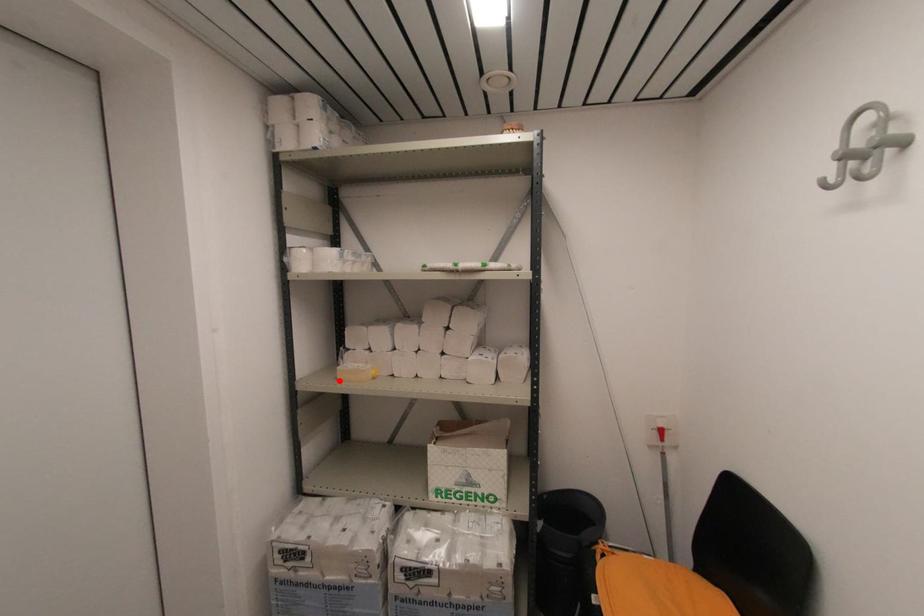
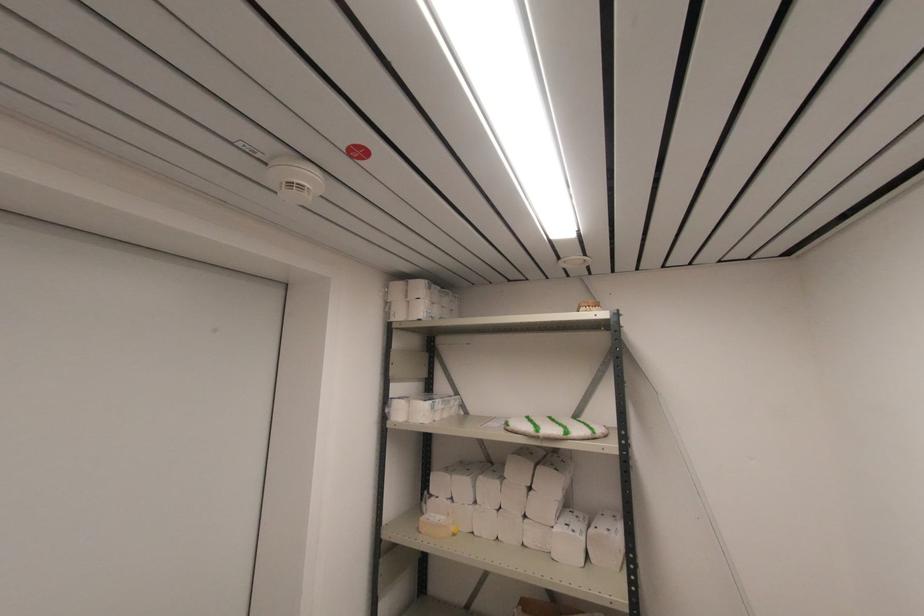
Find the pixel in the second image that matches the highlighted location in the first image.

(420, 533)